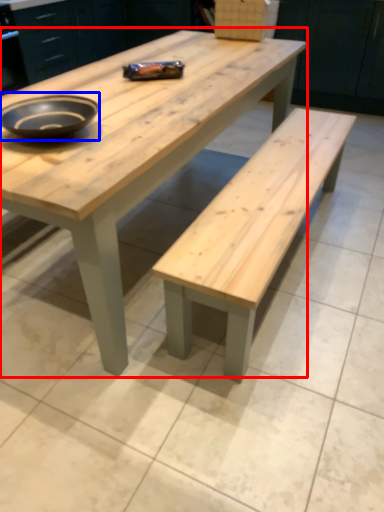
Question: Among these objects, which one is nearest to the camera, coffee table (highlighted by a red box) or bowl (highlighted by a blue box)?

Choices:
 (A) coffee table
 (B) bowl

Answer: (A)